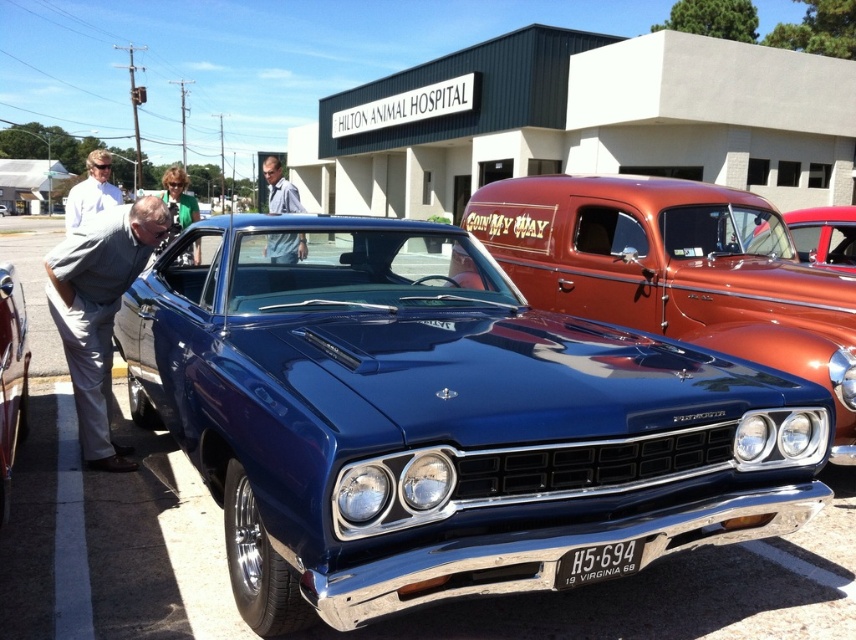
Who is more forward, (550, 358) or (76, 323)?

Point (550, 358) is in front.

Is shiny blue car at center taller than gray fabric pants at lower left?

Indeed, shiny blue car at center has a greater height compared to gray fabric pants at lower left.

Between point (189, 241) and point (76, 364), which one is positioned in front?

Point (76, 364) is more forward.

Where is `shiny blue car at center`? shiny blue car at center is located at coordinates (443, 422).

Based on the photo, which is more to the left, metallic blue car at center or white shirt at left?

From the viewer's perspective, white shirt at left appears more on the left side.

How distant is metallic blue car at center from white shirt at left?

metallic blue car at center is 3.71 meters from white shirt at left.

Image resolution: width=856 pixels, height=640 pixels. Describe the element at coordinates (10, 378) in the screenshot. I see `metallic blue car at center` at that location.

This screenshot has width=856, height=640. In order to click on metallic blue car at center in this screenshot , I will do `click(10, 378)`.

Is gray fabric pants at lower left to the left of white shirt at left from the viewer's perspective?

Incorrect, gray fabric pants at lower left is not on the left side of white shirt at left.

Who is taller, gray fabric pants at lower left or white shirt at left?

white shirt at left

What do you see at coordinates (99, 310) in the screenshot?
I see `gray fabric pants at lower left` at bounding box center [99, 310].

What are the coordinates of `gray fabric pants at lower left` in the screenshot? It's located at (99, 310).